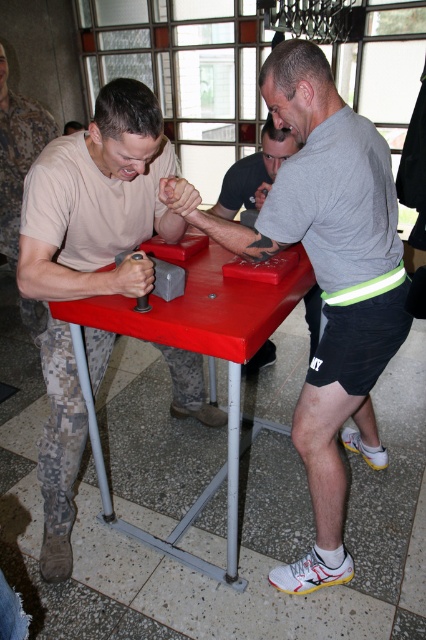
Does camouflage uniform at left have a greater width compared to red plastic table at center?

In fact, camouflage uniform at left might be narrower than red plastic table at center.

Is camouflage uniform at left bigger than red plastic table at center?

Incorrect, camouflage uniform at left is not larger than red plastic table at center.

The image size is (426, 640). In order to click on camouflage uniform at left in this screenshot , I will do `click(100, 202)`.

Which is more to the left, gray matte shirt at center or camouflage uniform at left?

camouflage uniform at left is more to the left.

Who is taller, gray matte shirt at center or camouflage uniform at left?

gray matte shirt at center is taller.

Does point (310, 560) lie in front of point (95, 372)?

Yes, it is.

Find the location of a particular element. This screenshot has height=640, width=426. gray matte shirt at center is located at coordinates (330, 282).

Does camouflage uniform at left appear over gray matte arm at center?

Actually, camouflage uniform at left is below gray matte arm at center.

Is point (81, 252) positioned after point (310, 348)?

That is False.

Locate an element on the screen. camouflage uniform at left is located at coordinates (100, 202).